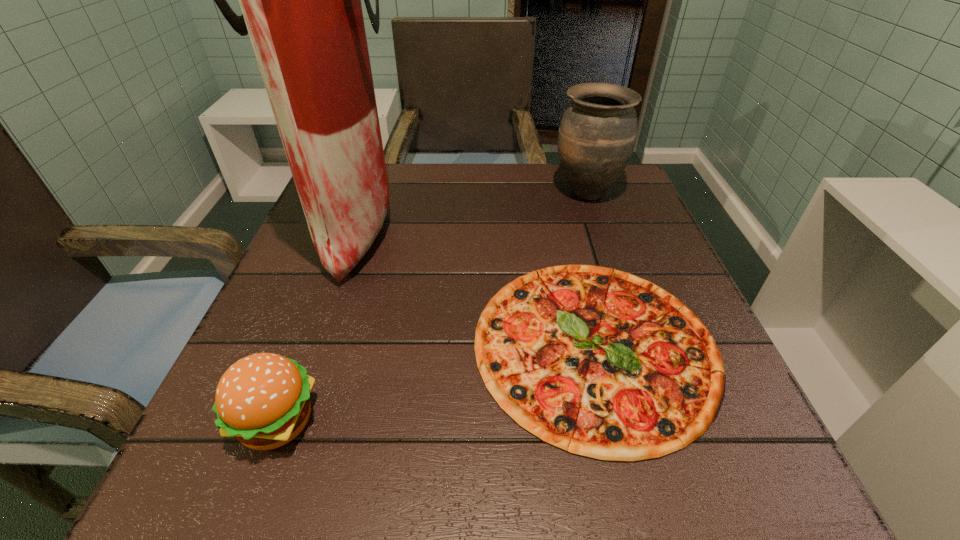
Find the location of a particular element. the tallest object is located at coordinates (301, 0).

Where is `urn`? The image size is (960, 540). urn is located at coordinates (597, 134).

Locate an element on the screen. Image resolution: width=960 pixels, height=540 pixels. the third tallest object is located at coordinates (263, 400).

Where is `pizza`? pizza is located at coordinates (599, 362).

Find the location of a particular element. vacant region located on the right of the grocery bag is located at coordinates (484, 228).

You are a GUI agent. You are given a task and a screenshot of the screen. Output one action in this format:
    pyautogui.click(x=<x>, y=<y>)
    Task: Click on the vacant space located on the front of the second tallest object
    
    Given the screenshot: What is the action you would take?
    pyautogui.click(x=627, y=309)

Locate an element on the screen. This screenshot has width=960, height=540. free space located on the back of the hamburger is located at coordinates (349, 230).

The height and width of the screenshot is (540, 960). Find the location of `vacant space positioned 0.300m on the back of the shortest object`. vacant space positioned 0.300m on the back of the shortest object is located at coordinates click(556, 187).

Find the location of a particular element. This screenshot has width=960, height=540. grocery bag that is at the far edge is located at coordinates (301, 0).

Identify the location of urn located at the far edge. (597, 134).